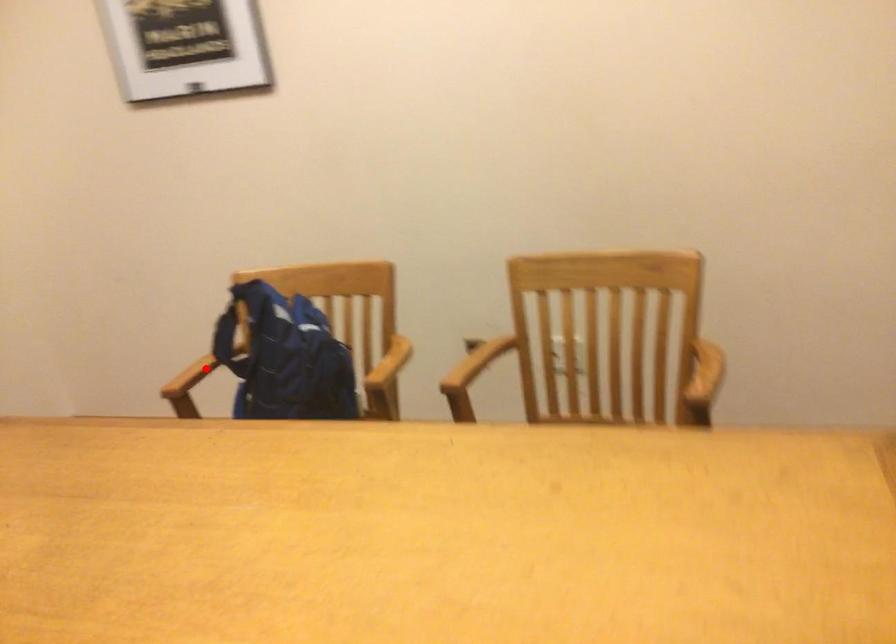
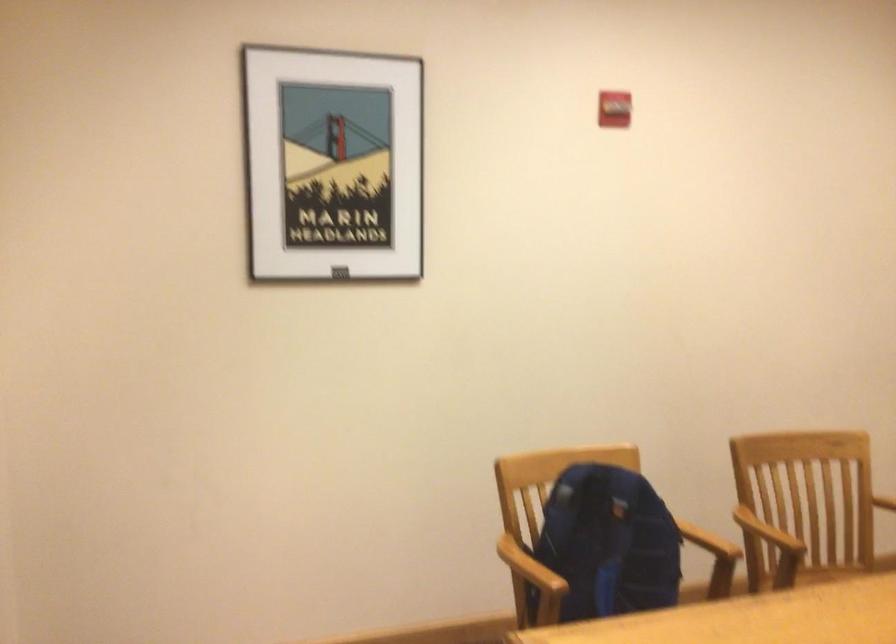
In the second image, find the point that corresponds to the highlighted location in the first image.

(530, 567)